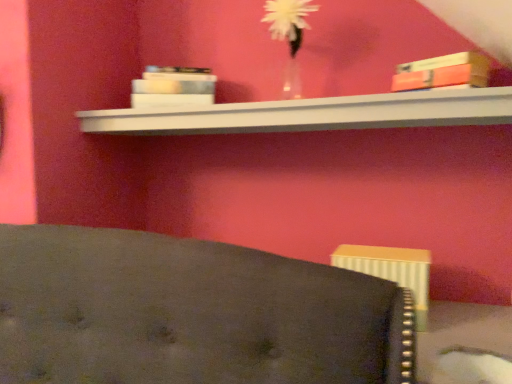
Question: From the image's perspective, would you say translucent glass vase at upper center is shown under white matte book at upper center, acting as the first book starting from the left?

Choices:
 (A) yes
 (B) no

Answer: (B)

Question: Could you tell me if translucent glass vase at upper center is turned towards white matte book at upper center, acting as the first book starting from the left?

Choices:
 (A) no
 (B) yes

Answer: (A)

Question: From the image's perspective, would you say translucent glass vase at upper center is positioned over white matte book at upper center, acting as the first book starting from the left?

Choices:
 (A) no
 (B) yes

Answer: (B)

Question: Is translucent glass vase at upper center thinner than white matte book at upper center, which is the 2th book from right to left?

Choices:
 (A) no
 (B) yes

Answer: (A)

Question: From a real-world perspective, is translucent glass vase at upper center located beneath white matte book at upper center, which is the 2th book from right to left?

Choices:
 (A) no
 (B) yes

Answer: (A)

Question: Is white glossy shelf at upper center taller or shorter than translucent glass vase at upper center?

Choices:
 (A) short
 (B) tall

Answer: (A)

Question: From the image's perspective, is white glossy shelf at upper center above or below translucent glass vase at upper center?

Choices:
 (A) below
 (B) above

Answer: (A)

Question: Considering the positions of white glossy shelf at upper center and translucent glass vase at upper center in the image, is white glossy shelf at upper center wider or thinner than translucent glass vase at upper center?

Choices:
 (A) wide
 (B) thin

Answer: (A)

Question: Considering the positions of white glossy shelf at upper center and translucent glass vase at upper center in the image, is white glossy shelf at upper center bigger or smaller than translucent glass vase at upper center?

Choices:
 (A) small
 (B) big

Answer: (B)

Question: From a real-world perspective, relative to matte orange book at upper right, which is the second book in left-to-right order, is white matte book at upper center, the first book from the back, vertically above or below?

Choices:
 (A) above
 (B) below

Answer: (A)

Question: From the image's perspective, is white matte book at upper center, arranged as the 2th book when viewed from the front, positioned above or below matte orange book at upper right, which is the second book in left-to-right order?

Choices:
 (A) above
 (B) below

Answer: (A)

Question: In the image, is white matte book at upper center, which is the 2th book from right to left, on the left side or the right side of matte orange book at upper right, which is the second book in left-to-right order?

Choices:
 (A) left
 (B) right

Answer: (A)

Question: Considering the positions of white matte book at upper center, arranged as the 2th book when viewed from the front, and matte orange book at upper right, which is the second book in left-to-right order, in the image, is white matte book at upper center, arranged as the 2th book when viewed from the front, bigger or smaller than matte orange book at upper right, which is the second book in left-to-right order,?

Choices:
 (A) big
 (B) small

Answer: (A)

Question: Considering the positions of white matte book at upper center, arranged as the 2th book when viewed from the front, and white glossy shelf at upper center in the image, is white matte book at upper center, arranged as the 2th book when viewed from the front, taller or shorter than white glossy shelf at upper center?

Choices:
 (A) short
 (B) tall

Answer: (B)

Question: From a real-world perspective, is white matte book at upper center, acting as the first book starting from the left, above or below white glossy shelf at upper center?

Choices:
 (A) above
 (B) below

Answer: (A)